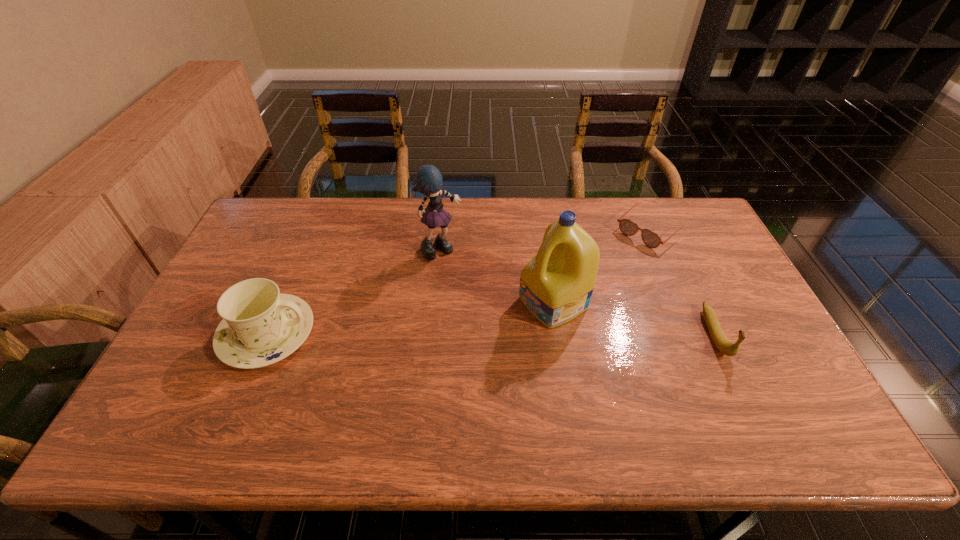
The image size is (960, 540). Identify the location of vacant spot on the desktop that is between the chinaware and the fourth tallest object and is positioned on the front-facing side of the shortest object. (529, 334).

Where is `free space on the desktop that is between the leftmost object and the fourth tallest object and is positioned on the label of the detergent`? This screenshot has height=540, width=960. free space on the desktop that is between the leftmost object and the fourth tallest object and is positioned on the label of the detergent is located at coordinates (493, 334).

You are a GUI agent. You are given a task and a screenshot of the screen. Output one action in this format:
    pyautogui.click(x=<x>, y=<y>)
    Task: Click on the free spot on the desktop that is between the chinaware and the banana and is positioned on the front-facing side of the rag doll
    This screenshot has width=960, height=540.
    Given the screenshot: What is the action you would take?
    pyautogui.click(x=538, y=334)